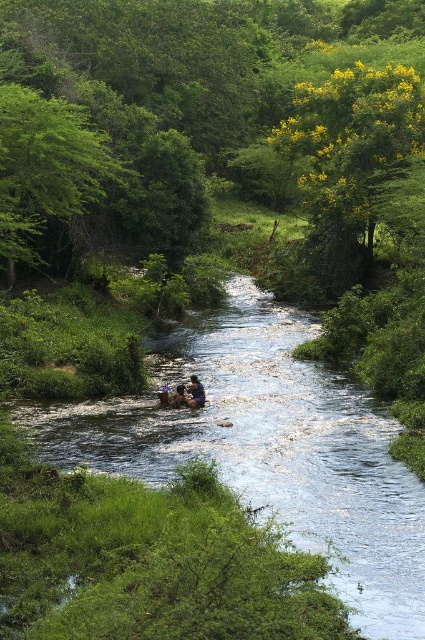
Between clear water stream at center and brown leather jacket at center, which one is positioned higher?

clear water stream at center

Between clear water stream at center and brown leather jacket at center, which one has less height?

With less height is brown leather jacket at center.

Is point (345, 388) positioned in front of point (170, 403)?

No, (345, 388) is further to viewer.

You are a GUI agent. You are given a task and a screenshot of the screen. Output one action in this format:
    pyautogui.click(x=<x>, y=<y>)
    Task: Click on the clear water stream at center
    The width and height of the screenshot is (425, 640).
    Given the screenshot: What is the action you would take?
    pyautogui.click(x=268, y=448)

Consider the image. Does clear water stream at center appear over yellow-green leaves at upper right?

Actually, clear water stream at center is below yellow-green leaves at upper right.

Is point (340, 502) positioned before point (354, 97)?

Yes, point (340, 502) is in front of point (354, 97).

Identify the location of clear water stream at center. Image resolution: width=425 pixels, height=640 pixels. (268, 448).

Can you confirm if green leafy tree at center is positioned above brown leather boat at center?

Correct, green leafy tree at center is located above brown leather boat at center.

Identify the location of green leafy tree at center. (183, 88).

Is point (268, 99) farther from camera compared to point (204, 390)?

That is True.

I want to click on green leafy tree at center, so point(183,88).